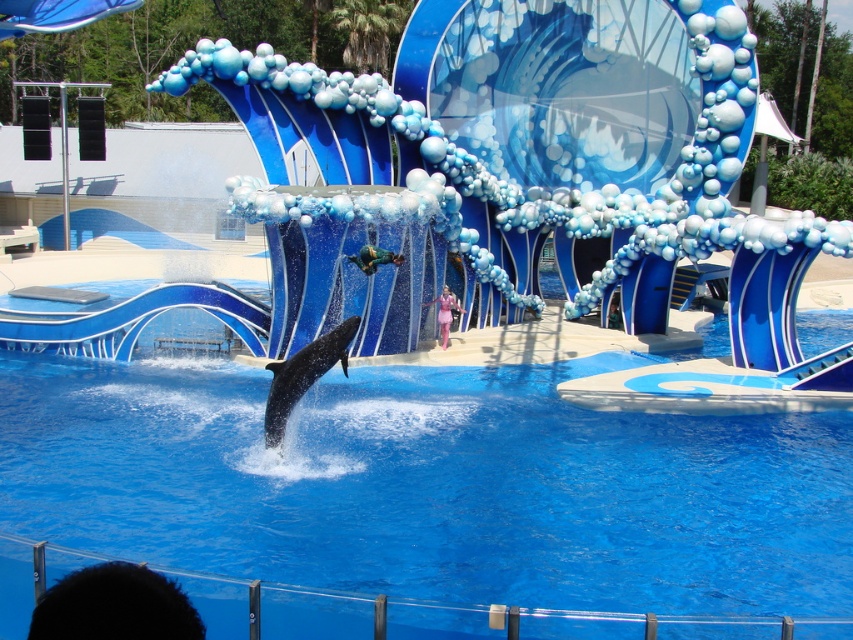
Which is more to the left, black smooth dolphin at center or green fabric person at center?

From the viewer's perspective, black smooth dolphin at center appears more on the left side.

Locate an element on the screen. The image size is (853, 640). black smooth dolphin at center is located at coordinates click(x=303, y=376).

Looking at this image, which of these two, black smooth dolphin at center or pink satin dress at center, stands taller?

With more height is pink satin dress at center.

Is black smooth dolphin at center behind pink satin dress at center?

No.

Who is more distant from viewer, (288, 364) or (447, 333)?

The point (447, 333) is more distant.

The image size is (853, 640). What are the coordinates of `black smooth dolphin at center` in the screenshot? It's located at (303, 376).

Is point (380, 262) closer to viewer compared to point (445, 285)?

Yes, point (380, 262) is in front of point (445, 285).

You are a GUI agent. You are given a task and a screenshot of the screen. Output one action in this format:
    pyautogui.click(x=<x>, y=<y>)
    Task: Click on the green fabric person at center
    
    Given the screenshot: What is the action you would take?
    pyautogui.click(x=374, y=259)